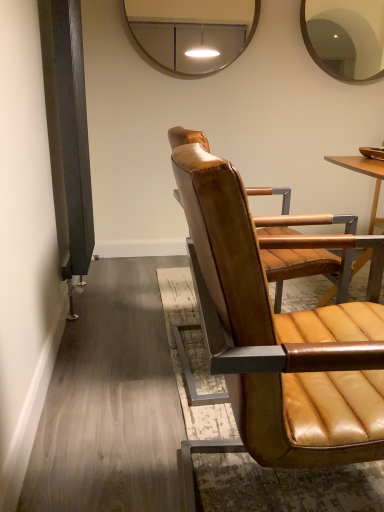
You are a GUI agent. You are given a task and a screenshot of the screen. Output one action in this format:
    pyautogui.click(x=<x>, y=<y>)
    Task: Click on the matte brown leather chair at center
    Image resolution: width=384 pixels, height=512 pixels.
    Given the screenshot: What is the action you would take?
    pos(276,333)

In order to face matte brown mirror at upper right, the second mirror viewed from the left, should I rotate leftwards or rightwards?

Turn right approximately 20.301 degrees to face it.

Identify the location of matte brown leather chair at center. This screenshot has height=512, width=384. (276, 333).

Between metallic silver mirror at upper center, arranged as the second mirror when viewed from the right, and matte brown leather chair at center, which one has smaller size?

metallic silver mirror at upper center, arranged as the second mirror when viewed from the right.

From the image's perspective, which object appears higher, metallic silver mirror at upper center, arranged as the second mirror when viewed from the right, or matte brown leather chair at center?

From the image's view, metallic silver mirror at upper center, arranged as the second mirror when viewed from the right, is above.

Does metallic silver mirror at upper center, arranged as the second mirror when viewed from the right, have a lesser width compared to matte brown leather chair at center?

Correct, the width of metallic silver mirror at upper center, arranged as the second mirror when viewed from the right, is less than that of matte brown leather chair at center.

Considering the relative positions of metallic silver mirror at upper center, arranged as the second mirror when viewed from the right, and matte brown leather chair at center in the image provided, is metallic silver mirror at upper center, arranged as the second mirror when viewed from the right, to the right of matte brown leather chair at center from the viewer's perspective?

No.

Choose the correct answer: Is metallic silver mirror at upper center, which is the 1th mirror from left to right, inside matte brown mirror at upper right, marked as the first mirror in a right-to-left arrangement, or outside it?

metallic silver mirror at upper center, which is the 1th mirror from left to right, is outside matte brown mirror at upper right, marked as the first mirror in a right-to-left arrangement.

Which object is positioned more to the left, metallic silver mirror at upper center, which is the 1th mirror from left to right, or matte brown mirror at upper right, the second mirror viewed from the left?

metallic silver mirror at upper center, which is the 1th mirror from left to right, is more to the left.

Between metallic silver mirror at upper center, which is the 1th mirror from left to right, and matte brown mirror at upper right, the second mirror viewed from the left, which one has smaller width?

With smaller width is metallic silver mirror at upper center, which is the 1th mirror from left to right.

Identify the location of mirror in front of the matte brown mirror at upper right, the second mirror viewed from the left. The image size is (384, 512). pyautogui.click(x=192, y=32).

Considering the sizes of matte brown mirror at upper right, the second mirror viewed from the left, and matte brown leather chair at center in the image, is matte brown mirror at upper right, the second mirror viewed from the left, wider or thinner than matte brown leather chair at center?

Considering their sizes, matte brown mirror at upper right, the second mirror viewed from the left, looks slimmer than matte brown leather chair at center.

Visually, is matte brown mirror at upper right, marked as the first mirror in a right-to-left arrangement, positioned to the left or to the right of matte brown leather chair at center?

From the image, it's evident that matte brown mirror at upper right, marked as the first mirror in a right-to-left arrangement, is to the right of matte brown leather chair at center.

Considering the relative sizes of matte brown mirror at upper right, marked as the first mirror in a right-to-left arrangement, and matte brown leather chair at center in the image provided, is matte brown mirror at upper right, marked as the first mirror in a right-to-left arrangement, shorter than matte brown leather chair at center?

Indeed, matte brown mirror at upper right, marked as the first mirror in a right-to-left arrangement, has a lesser height compared to matte brown leather chair at center.

How different are the orientations of matte brown mirror at upper right, marked as the first mirror in a right-to-left arrangement, and matte brown leather chair at center in degrees?

They differ by 86.4 degrees in their facing directions.

Are matte brown mirror at upper right, marked as the first mirror in a right-to-left arrangement, and metallic silver mirror at upper center, which is the 1th mirror from left to right, making contact?

No.

Locate an element on the screen. This screenshot has width=384, height=512. mirror that appears on the left of matte brown mirror at upper right, the second mirror viewed from the left is located at coordinates (192, 32).

In the scene shown: Considering the positions of objects matte brown mirror at upper right, the second mirror viewed from the left, and metallic silver mirror at upper center, which is the 1th mirror from left to right, in the image provided, who is in front, matte brown mirror at upper right, the second mirror viewed from the left, or metallic silver mirror at upper center, which is the 1th mirror from left to right,?

metallic silver mirror at upper center, which is the 1th mirror from left to right.

From the image's perspective, does matte brown leather chair at center appear lower than matte brown mirror at upper right, marked as the first mirror in a right-to-left arrangement?

Yes, from the image's perspective, matte brown leather chair at center is beneath matte brown mirror at upper right, marked as the first mirror in a right-to-left arrangement.

Considering the relative sizes of matte brown leather chair at center and matte brown mirror at upper right, marked as the first mirror in a right-to-left arrangement, in the image provided, is matte brown leather chair at center taller than matte brown mirror at upper right, marked as the first mirror in a right-to-left arrangement,?

Correct, matte brown leather chair at center is much taller as matte brown mirror at upper right, marked as the first mirror in a right-to-left arrangement.

Is matte brown leather chair at center looking in the opposite direction of matte brown mirror at upper right, marked as the first mirror in a right-to-left arrangement?

No.

Is matte brown leather chair at center next to metallic silver mirror at upper center, arranged as the second mirror when viewed from the right?

No, matte brown leather chair at center is not touching metallic silver mirror at upper center, arranged as the second mirror when viewed from the right.

Can you confirm if matte brown leather chair at center is smaller than metallic silver mirror at upper center, which is the 1th mirror from left to right?

No, matte brown leather chair at center is not smaller than metallic silver mirror at upper center, which is the 1th mirror from left to right.

Is point (281, 466) in front of point (164, 42)?

Yes.

Find the location of a particular element. This screenshot has width=384, height=512. chair to the right of metallic silver mirror at upper center, arranged as the second mirror when viewed from the right is located at coordinates (276, 333).

Identify the location of mirror behind the metallic silver mirror at upper center, arranged as the second mirror when viewed from the right. (345, 37).

Consider the image. Which object lies nearer to the anchor point matte brown leather chair at center, matte brown mirror at upper right, marked as the first mirror in a right-to-left arrangement, or metallic silver mirror at upper center, which is the 1th mirror from left to right?

matte brown mirror at upper right, marked as the first mirror in a right-to-left arrangement, is closer to matte brown leather chair at center.

Considering their positions, is matte brown leather chair at center positioned closer to matte brown mirror at upper right, marked as the first mirror in a right-to-left arrangement, than metallic silver mirror at upper center, arranged as the second mirror when viewed from the right?

The object closer to matte brown mirror at upper right, marked as the first mirror in a right-to-left arrangement, is metallic silver mirror at upper center, arranged as the second mirror when viewed from the right.

Considering their positions, is metallic silver mirror at upper center, arranged as the second mirror when viewed from the right, positioned further to matte brown mirror at upper right, the second mirror viewed from the left, than matte brown leather chair at center?

matte brown leather chair at center lies further to matte brown mirror at upper right, the second mirror viewed from the left, than the other object.

From the image, which object appears to be farther from matte brown leather chair at center, metallic silver mirror at upper center, arranged as the second mirror when viewed from the right, or matte brown mirror at upper right, marked as the first mirror in a right-to-left arrangement?

The object further to matte brown leather chair at center is metallic silver mirror at upper center, arranged as the second mirror when viewed from the right.

Considering their positions, is matte brown mirror at upper right, the second mirror viewed from the left, positioned further to metallic silver mirror at upper center, arranged as the second mirror when viewed from the right, than matte brown leather chair at center?

matte brown leather chair at center lies further to metallic silver mirror at upper center, arranged as the second mirror when viewed from the right, than the other object.

Estimate the real-world distances between objects in this image. Which object is further from metallic silver mirror at upper center, which is the 1th mirror from left to right, matte brown leather chair at center or matte brown mirror at upper right, marked as the first mirror in a right-to-left arrangement?

Among the two, matte brown leather chair at center is located further to metallic silver mirror at upper center, which is the 1th mirror from left to right.

Find the location of a particular element. This screenshot has width=384, height=512. mirror located between matte brown leather chair at center and matte brown mirror at upper right, the second mirror viewed from the left, in the depth direction is located at coordinates (192, 32).